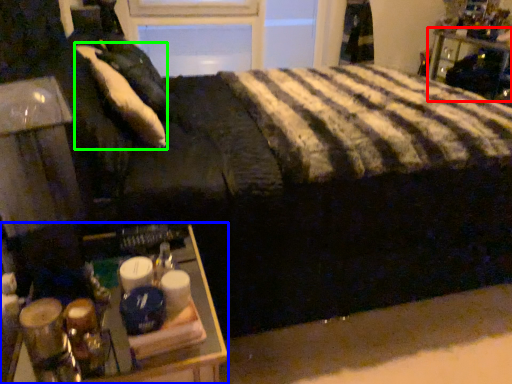
Question: Which object is positioned closest to furniture (highlighted by a red box)? Select from table (highlighted by a blue box) and pillow (highlighted by a green box).

Choices:
 (A) table
 (B) pillow

Answer: (B)